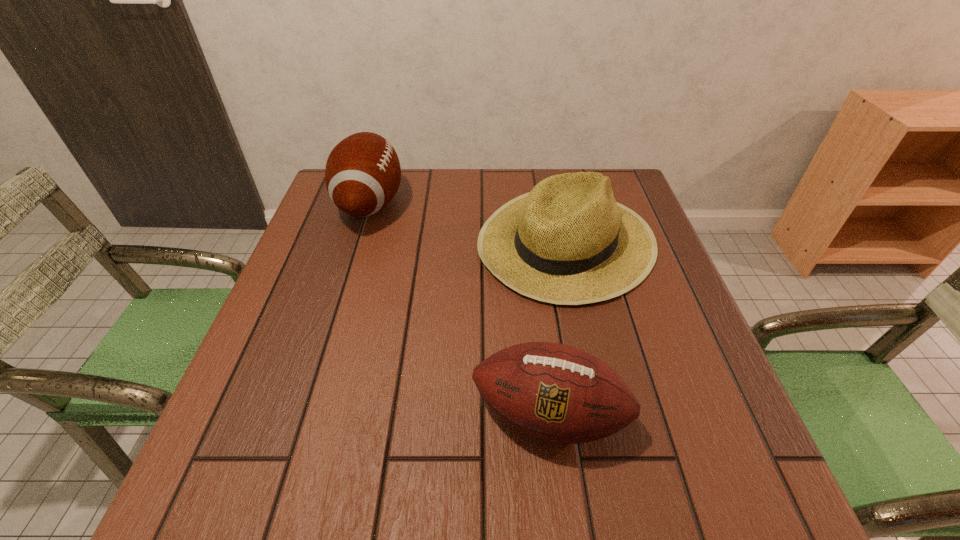
Image resolution: width=960 pixels, height=540 pixels. Find the location of `blank area in the image that satisfies the following two spatial constraints: 1. on the laces of the taller football (American); 2. on the back side of the nearest object`. blank area in the image that satisfies the following two spatial constraints: 1. on the laces of the taller football (American); 2. on the back side of the nearest object is located at coordinates (304, 415).